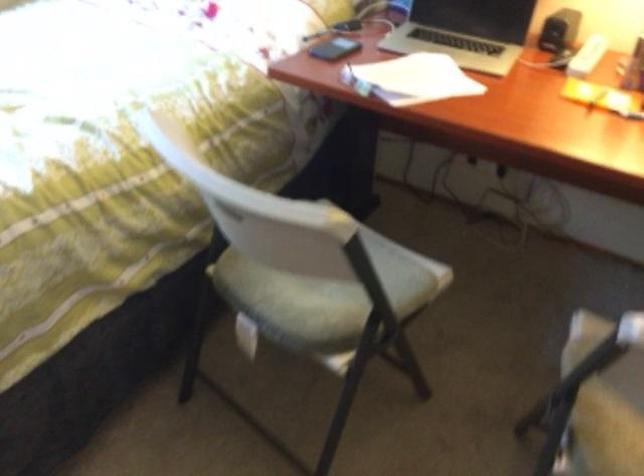
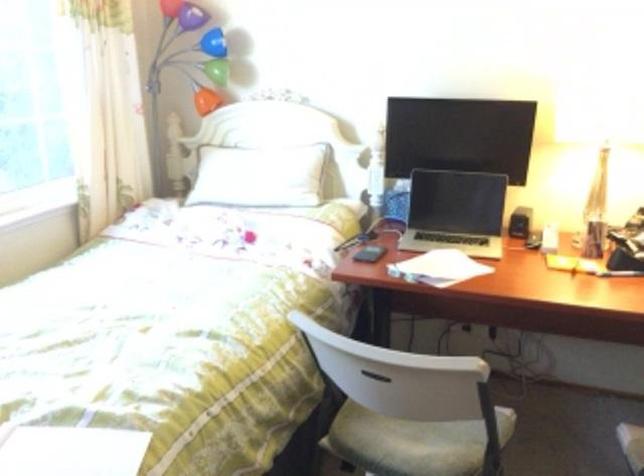
The images are taken continuously from a first-person perspective. In which direction are you moving?

The cameraman moved toward left, backward.